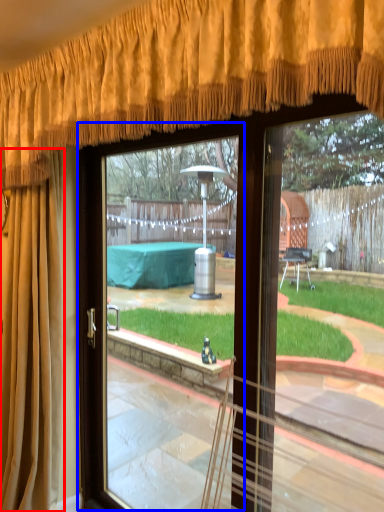
Question: Which object is further to the camera taking this photo, curtain (highlighted by a red box) or screen door (highlighted by a blue box)?

Choices:
 (A) curtain
 (B) screen door

Answer: (A)